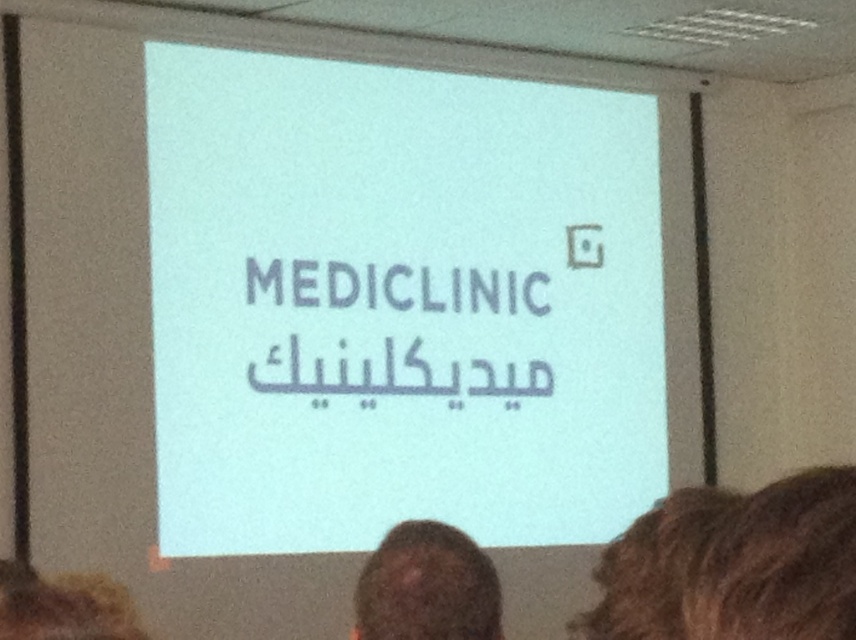
Question: Estimate the real-world distances between objects in this image. Which object is farther from the blonde hair at lower left?

Choices:
 (A) white matte projection screen at center
 (B) brown curly hair at lower right
 (C) brown hair at lower center

Answer: (A)

Question: Is brown curly hair at lower right bigger than blonde hair at lower left?

Choices:
 (A) yes
 (B) no

Answer: (A)

Question: Which of the following is the closest to the observer?

Choices:
 (A) white matte projection screen at center
 (B) blonde hair at lower left
 (C) brown hair at lower center

Answer: (B)

Question: Among these objects, which one is nearest to the camera?

Choices:
 (A) brown curly hair at lower right
 (B) white matte projection screen at center
 (C) brown hair at lower center

Answer: (A)

Question: Observing the image, what is the correct spatial positioning of white matte projection screen at center in reference to brown curly hair at lower right?

Choices:
 (A) right
 (B) left

Answer: (B)

Question: Is brown curly hair at lower right to the left of blonde hair at lower left from the viewer's perspective?

Choices:
 (A) yes
 (B) no

Answer: (B)